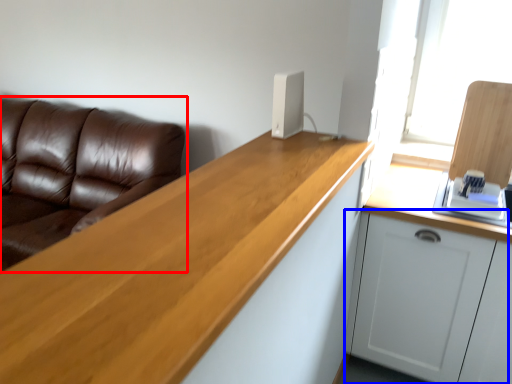
Question: Which of the following is the closest to the observer, studio couch (highlighted by a red box) or cabinetry (highlighted by a blue box)?

Choices:
 (A) studio couch
 (B) cabinetry

Answer: (B)